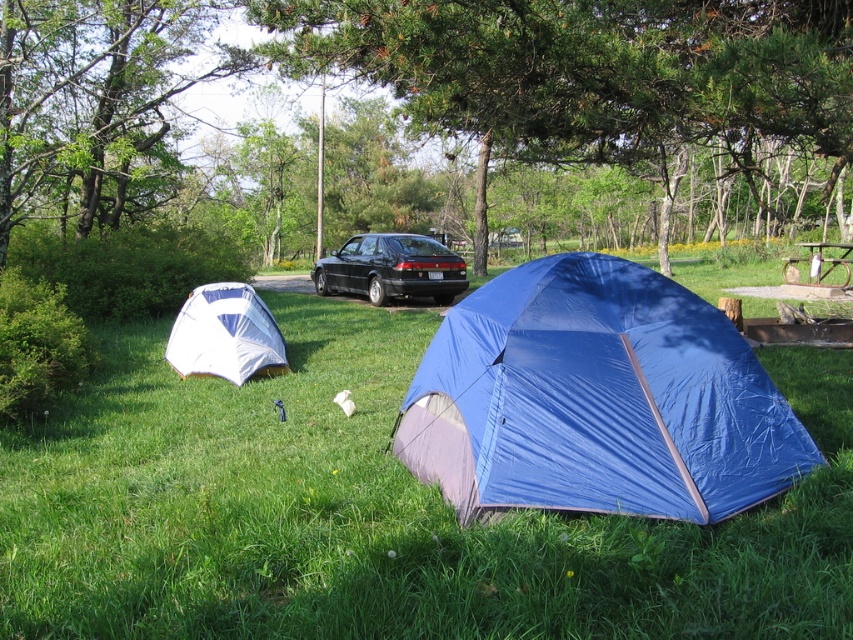
Which is above, green leafy tree at upper left or rustic wood picnic table at center?

green leafy tree at upper left is above.

Which is below, green leafy tree at upper left or rustic wood picnic table at center?

rustic wood picnic table at center

Find the location of a particular element. The image size is (853, 640). green leafy tree at upper left is located at coordinates (97, 104).

Locate an element on the screen. The width and height of the screenshot is (853, 640). green leafy tree at upper left is located at coordinates (97, 104).

Does blue tarpaulin tent at center have a greater height compared to rustic wood picnic table at center?

Indeed, blue tarpaulin tent at center has a greater height compared to rustic wood picnic table at center.

Identify the location of blue tarpaulin tent at center. [x=596, y=400].

Between green leafy tree at upper center and rustic wood picnic table at center, which one is positioned higher?

green leafy tree at upper center

Who is positioned more to the left, green leafy tree at upper center or rustic wood picnic table at center?

green leafy tree at upper center

Locate an element on the screen. green leafy tree at upper center is located at coordinates (595, 74).

At what (x,y) coordinates should I click in order to perform the action: click on green leafy tree at upper center. Please return your answer as a coordinate pair (x, y). This screenshot has width=853, height=640. Looking at the image, I should click on (595, 74).